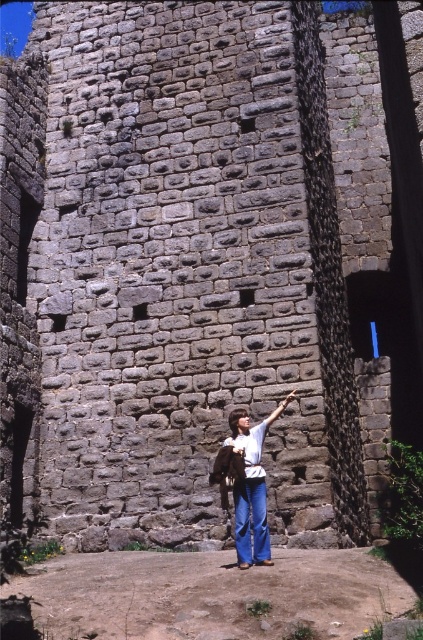
Can you confirm if denim pants at center is wider than smooth skin hand at upper center?

Correct, the width of denim pants at center exceeds that of smooth skin hand at upper center.

Does denim pants at center appear on the right side of smooth skin hand at upper center?

No, denim pants at center is not to the right of smooth skin hand at upper center.

Between point (261, 429) and point (294, 397), which one is positioned behind?

The point (294, 397) is more distant.

Find the location of `denim pants at center`. denim pants at center is located at coordinates (246, 484).

Does denim pants at center appear over matte brown leather arm at center?

No.

Is denim pants at center to the left of matte brown leather arm at center from the viewer's perspective?

Yes, denim pants at center is to the left of matte brown leather arm at center.

Does point (282, 403) come in front of point (282, 412)?

No.

The image size is (423, 640). Identify the location of denim pants at center. (246, 484).

Does denim pants at center lie behind matte brown hand at center?

No, it is in front of matte brown hand at center.

Between denim pants at center and matte brown hand at center, which one has less height?

With less height is matte brown hand at center.

The height and width of the screenshot is (640, 423). What do you see at coordinates (246, 484) in the screenshot? I see `denim pants at center` at bounding box center [246, 484].

Locate an element on the screen. This screenshot has height=640, width=423. denim pants at center is located at coordinates (246, 484).